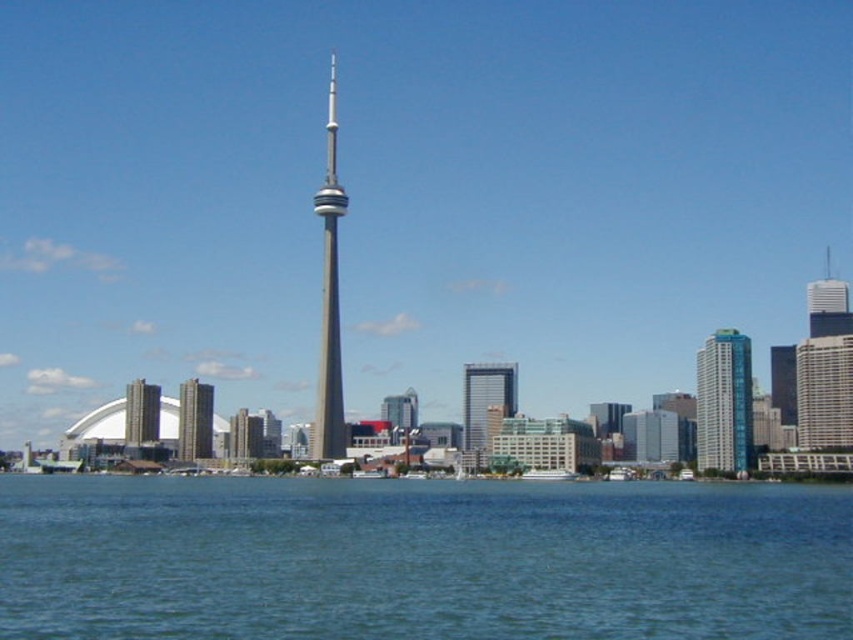
Is silver metallic tower at center shorter than glassy reflective skyscraper at center?

No.

What do you see at coordinates (329, 298) in the screenshot?
I see `silver metallic tower at center` at bounding box center [329, 298].

Find the location of a particular element. silver metallic tower at center is located at coordinates (329, 298).

Can you confirm if glassy reflective skyscraper at center is wider than brick textured building at left?

Indeed, glassy reflective skyscraper at center has a greater width compared to brick textured building at left.

The image size is (853, 640). I want to click on glassy reflective skyscraper at center, so click(485, 406).

Where is `glassy reflective skyscraper at center`? This screenshot has height=640, width=853. glassy reflective skyscraper at center is located at coordinates (485, 406).

Find the location of `glassy reflective skyscraper at center`. glassy reflective skyscraper at center is located at coordinates (485, 406).

Does glassy reflective skyscraper at center appear on the left side of brown textured building at center?

Incorrect, glassy reflective skyscraper at center is not on the left side of brown textured building at center.

Does point (488, 435) lie behind point (196, 404)?

Yes, it is.

Is point (505, 392) positioned after point (190, 426)?

That is True.

Where is `glassy reflective skyscraper at center`? glassy reflective skyscraper at center is located at coordinates (485, 406).